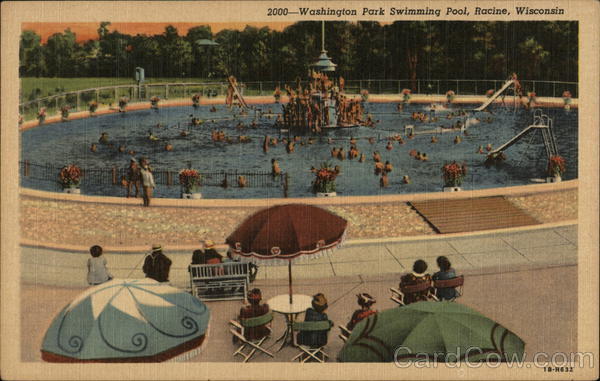
Where is `border of picture`? border of picture is located at coordinates (584, 265), (238, 374), (10, 298), (145, 6).